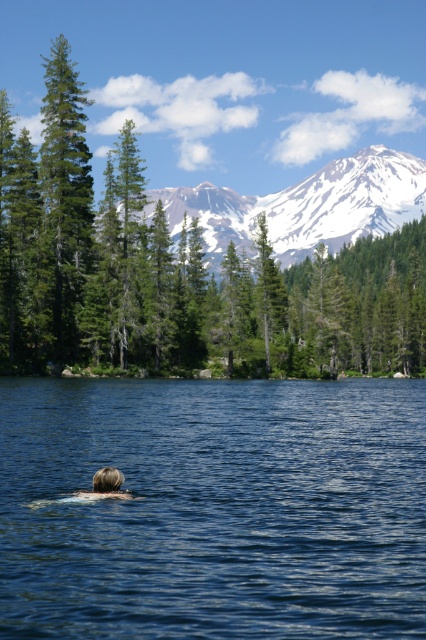
Is snowy mountain at upper center closer to camera compared to blonde hair at lower center?

No.

At what (x,y) coordinates should I click in order to perform the action: click on snowy mountain at upper center. Please return your answer as a coordinate pair (x, y). Looking at the image, I should click on (305, 205).

Is point (164, 196) behind point (106, 492)?

Yes, point (164, 196) is farther from viewer.

Find the location of a particular element. The height and width of the screenshot is (640, 426). snowy mountain at upper center is located at coordinates (305, 205).

Does snowy mountain at upper center have a smaller size compared to green matte tree at upper left?

No.

Consider the image. Does snowy mountain at upper center come behind green matte tree at upper left?

That is True.

The width and height of the screenshot is (426, 640). Identify the location of snowy mountain at upper center. (305, 205).

Who is more forward, (68, 122) or (60, 148)?

Point (60, 148) is in front.

Is point (108, 189) positioned before point (51, 93)?

No, (108, 189) is further to viewer.

Locate an element on the screen. This screenshot has height=640, width=426. green matte tree at upper center is located at coordinates (91, 250).